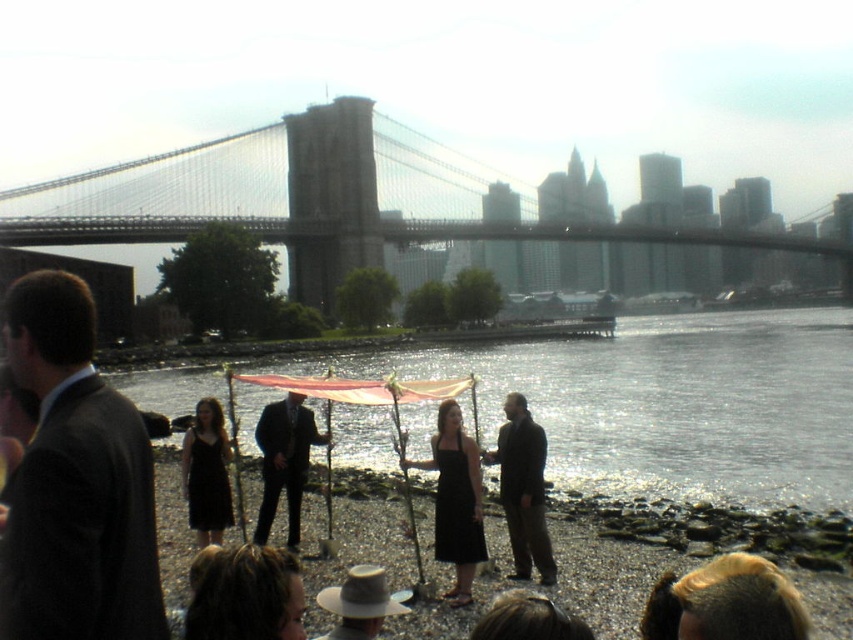
Is brown hair at lower center thinner than black satin dress at center?

No.

Is brown hair at lower center smaller than black satin dress at center?

Correct, brown hair at lower center occupies less space than black satin dress at center.

The image size is (853, 640). In order to click on brown hair at lower center in this screenshot , I will do `click(245, 595)`.

Measure the distance between brown hair at lower center and matte black suit at center.

brown hair at lower center is 68.46 feet from matte black suit at center.

Looking at this image, between brown hair at lower center and matte black suit at center, which one is positioned higher?

Positioned higher is matte black suit at center.

What do you see at coordinates (245, 595) in the screenshot? I see `brown hair at lower center` at bounding box center [245, 595].

Identify the location of brown hair at lower center. (245, 595).

Does point (506, 237) lie behind point (196, 444)?

Yes, point (506, 237) is farther from viewer.

I want to click on stone bridge at center, so click(320, 196).

Which is in front, point (114, 196) or point (196, 522)?

Point (196, 522)

The width and height of the screenshot is (853, 640). I want to click on stone bridge at center, so click(x=320, y=196).